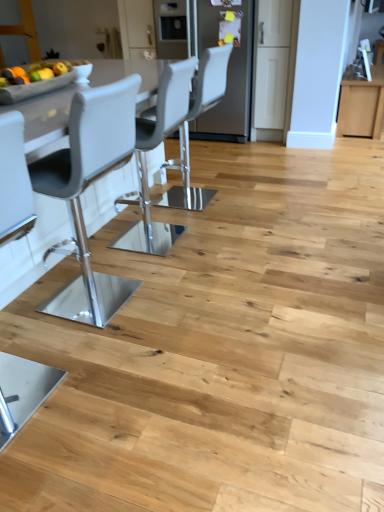
I want to click on matte gray chair at left, the 2th chair when ordered from right to left, so click(14, 181).

You are a GUI agent. You are given a task and a screenshot of the screen. Output one action in this format:
    pyautogui.click(x=<x>, y=<y>)
    Task: Click on the satin stainless steel refrigerator at center
    
    Given the screenshot: What is the action you would take?
    pyautogui.click(x=227, y=65)

Locate an element on the screen. The width and height of the screenshot is (384, 512). matte gray chair at left, the first chair viewed from the left is located at coordinates (14, 181).

Between matte gray chair at left, which is counted as the 1th chair, starting from the bottom, and matte gray chair at center, acting as the second chair starting from the left, which one has smaller width?

matte gray chair at left, which is counted as the 1th chair, starting from the bottom, is thinner.

Is matte gray chair at left, the first chair viewed from the left, facing away from matte gray chair at center, which is counted as the first chair, starting from the top?

No, matte gray chair at left, the first chair viewed from the left, is not facing the opposite direction of matte gray chair at center, which is counted as the first chair, starting from the top.

Is matte gray chair at left, the first chair viewed from the left, located outside matte gray chair at center, marked as the second chair in a front-to-back arrangement?

matte gray chair at left, the first chair viewed from the left, lies outside matte gray chair at center, marked as the second chair in a front-to-back arrangement,'s area.

Identify the location of chair lying below the matte gray chair at center, placed as the 2th chair when sorted from bottom to top (from the image's perspective). The height and width of the screenshot is (512, 384). (14, 181).

I want to click on appliance above the matte gray chair at center, which is the 1th chair in back-to-front order (from the image's perspective), so click(227, 65).

From the image's perspective, is satin stainless steel refrigerator at center located above or below matte gray chair at center, acting as the first chair starting from the right?

A: satin stainless steel refrigerator at center is situated higher than matte gray chair at center, acting as the first chair starting from the right, in the image.

Which object is more forward, satin stainless steel refrigerator at center or matte gray chair at center, acting as the first chair starting from the right?

matte gray chair at center, acting as the first chair starting from the right, is closer to the camera.

Which of these two, satin stainless steel refrigerator at center or matte gray chair at center, acting as the second chair starting from the left, is thinner?

matte gray chair at center, acting as the second chair starting from the left, is thinner.

Considering the relative sizes of matte gray chair at center, acting as the first chair starting from the right, and satin stainless steel refrigerator at center in the image provided, is matte gray chair at center, acting as the first chair starting from the right, thinner than satin stainless steel refrigerator at center?

Indeed, matte gray chair at center, acting as the first chair starting from the right, has a lesser width compared to satin stainless steel refrigerator at center.

Locate an element on the screen. The image size is (384, 512). appliance behind the matte gray chair at center, placed as the 2th chair when sorted from bottom to top is located at coordinates (227, 65).

Considering the sizes of matte gray chair at center, marked as the second chair in a front-to-back arrangement, and satin stainless steel refrigerator at center in the image, is matte gray chair at center, marked as the second chair in a front-to-back arrangement, bigger or smaller than satin stainless steel refrigerator at center?

A: In the image, matte gray chair at center, marked as the second chair in a front-to-back arrangement, appears to be smaller than satin stainless steel refrigerator at center.

Is point (205, 73) closer to viewer compared to point (193, 30)?

Yes, it is.

Considering the relative positions of matte gray chair at left, placed as the second chair when sorted from back to front, and satin stainless steel refrigerator at center in the image provided, is matte gray chair at left, placed as the second chair when sorted from back to front, to the left or to the right of satin stainless steel refrigerator at center?

From the image, it's evident that matte gray chair at left, placed as the second chair when sorted from back to front, is to the left of satin stainless steel refrigerator at center.

Is matte gray chair at left, which is the first chair from front to back, placed right next to satin stainless steel refrigerator at center?

No, matte gray chair at left, which is the first chair from front to back, is not beside satin stainless steel refrigerator at center.

Could you tell me if matte gray chair at left, the 2th chair when ordered from right to left, is facing satin stainless steel refrigerator at center?

No, matte gray chair at left, the 2th chair when ordered from right to left, is not turned towards satin stainless steel refrigerator at center.

Is satin stainless steel refrigerator at center completely or partially inside matte gray chair at left, placed as the second chair when sorted from back to front?

No, satin stainless steel refrigerator at center is located outside of matte gray chair at left, placed as the second chair when sorted from back to front.

Would you say matte gray chair at left, the first chair viewed from the left, is part of satin stainless steel refrigerator at center's contents?

No, matte gray chair at left, the first chair viewed from the left, is not surrounded by satin stainless steel refrigerator at center.

Is satin stainless steel refrigerator at center looking in the opposite direction of matte gray chair at left, which is counted as the 1th chair, starting from the bottom?

No, satin stainless steel refrigerator at center's orientation is not away from matte gray chair at left, which is counted as the 1th chair, starting from the bottom.

Can you tell me how much satin stainless steel refrigerator at center and matte gray chair at left, the 2th chair when ordered from right to left, differ in facing direction?

The facing directions of satin stainless steel refrigerator at center and matte gray chair at left, the 2th chair when ordered from right to left, are 91.8 degrees apart.

Looking at this image, is satin stainless steel refrigerator at center next to matte gray chair at left, the first chair viewed from the left, and touching it?

No, satin stainless steel refrigerator at center is not touching matte gray chair at left, the first chair viewed from the left.

You are a GUI agent. You are given a task and a screenshot of the screen. Output one action in this format:
    pyautogui.click(x=<x>, y=<y>)
    Task: Click on the chair behind the matte gray chair at left, the first chair viewed from the left
    This screenshot has width=384, height=512.
    Given the screenshot: What is the action you would take?
    point(194,119)

Which object is wider, matte gray chair at center, placed as the 2th chair when sorted from bottom to top, or matte gray chair at left, placed as the second chair when sorted from back to front?

Wider between the two is matte gray chair at center, placed as the 2th chair when sorted from bottom to top.

Is matte gray chair at center, acting as the second chair starting from the left, turned away from matte gray chair at left, placed as the second chair when sorted from back to front?

That's not correct — matte gray chair at center, acting as the second chair starting from the left, is not looking away from matte gray chair at left, placed as the second chair when sorted from back to front.

Where is `chair above the matte gray chair at center, marked as the second chair in a front-to-back arrangement (from a real-world perspective)`? This screenshot has height=512, width=384. chair above the matte gray chair at center, marked as the second chair in a front-to-back arrangement (from a real-world perspective) is located at coordinates (14, 181).

Find the location of a particular element. Image resolution: width=384 pixels, height=512 pixels. appliance on the right of the matte gray chair at center, placed as the 2th chair when sorted from bottom to top is located at coordinates (227, 65).

Looking at the image, which one is located closer to matte gray chair at center, acting as the second chair starting from the left, matte gray chair at left, the first chair viewed from the left, or satin stainless steel refrigerator at center?

satin stainless steel refrigerator at center.

When comparing their distances from matte gray chair at center, placed as the 2th chair when sorted from bottom to top, does satin stainless steel refrigerator at center or matte gray chair at left, acting as the 2th chair starting from the top, seem further?

Based on the image, matte gray chair at left, acting as the 2th chair starting from the top, appears to be further to matte gray chair at center, placed as the 2th chair when sorted from bottom to top.

Looking at the image, which one is located closer to matte gray chair at left, which is counted as the 1th chair, starting from the bottom, matte gray chair at center, marked as the second chair in a front-to-back arrangement, or satin stainless steel refrigerator at center?

The object closer to matte gray chair at left, which is counted as the 1th chair, starting from the bottom, is matte gray chair at center, marked as the second chair in a front-to-back arrangement.

Which object lies nearer to the anchor point satin stainless steel refrigerator at center, matte gray chair at left, the first chair viewed from the left, or matte gray chair at center, which is counted as the first chair, starting from the top?

The object closer to satin stainless steel refrigerator at center is matte gray chair at center, which is counted as the first chair, starting from the top.

From the image, which object appears to be farther from matte gray chair at left, placed as the second chair when sorted from back to front, satin stainless steel refrigerator at center or matte gray chair at center, acting as the second chair starting from the left?

satin stainless steel refrigerator at center is positioned further to the anchor matte gray chair at left, placed as the second chair when sorted from back to front.

Based on their spatial positions, is matte gray chair at center, acting as the second chair starting from the left, or matte gray chair at left, the first chair viewed from the left, further from satin stainless steel refrigerator at center?

matte gray chair at left, the first chair viewed from the left, is further to satin stainless steel refrigerator at center.

You are a GUI agent. You are given a task and a screenshot of the screen. Output one action in this format:
    pyautogui.click(x=<x>, y=<y>)
    Task: Click on the chair between matte gray chair at left, which is the first chair from front to back, and satin stainless steel refrigerator at center from front to back
    
    Given the screenshot: What is the action you would take?
    pyautogui.click(x=194, y=119)